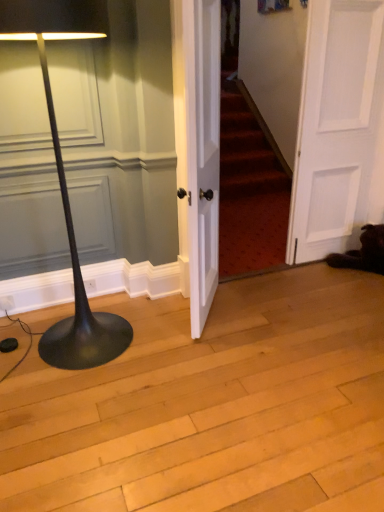
Question: Should I look upward or downward to see white matte door at right, which is counted as the 2th door, starting from the left?

Choices:
 (A) up
 (B) down

Answer: (A)

Question: Should I look upward or downward to see white wood door at center, the first door positioned from the left?

Choices:
 (A) down
 (B) up

Answer: (B)

Question: Is white matte door at right, which is counted as the 2th door, starting from the left, facing towards white wood door at center, the second door when ordered from right to left?

Choices:
 (A) yes
 (B) no

Answer: (B)

Question: Is white matte door at right, which is counted as the 2th door, starting from the left, bigger than white wood door at center, the second door when ordered from right to left?

Choices:
 (A) no
 (B) yes

Answer: (A)

Question: Considering the relative sizes of white matte door at right, acting as the 1th door starting from the right, and white wood door at center, the first door positioned from the left, in the image provided, is white matte door at right, acting as the 1th door starting from the right, thinner than white wood door at center, the first door positioned from the left,?

Choices:
 (A) yes
 (B) no

Answer: (A)

Question: Considering the relative sizes of white matte door at right, acting as the 1th door starting from the right, and white wood door at center, the first door positioned from the left, in the image provided, is white matte door at right, acting as the 1th door starting from the right, smaller than white wood door at center, the first door positioned from the left,?

Choices:
 (A) yes
 (B) no

Answer: (A)

Question: Are white matte door at right, which is counted as the 2th door, starting from the left, and white wood door at center, the second door when ordered from right to left, located far from each other?

Choices:
 (A) yes
 (B) no

Answer: (B)

Question: Does white matte door at right, acting as the 1th door starting from the right, appear on the left side of white wood door at center, the first door positioned from the left?

Choices:
 (A) yes
 (B) no

Answer: (B)

Question: Does black matte floor lamp at left have a lesser height compared to white matte door at right, acting as the 1th door starting from the right?

Choices:
 (A) no
 (B) yes

Answer: (B)

Question: From the image's perspective, would you say black matte floor lamp at left is positioned over white matte door at right, acting as the 1th door starting from the right?

Choices:
 (A) yes
 (B) no

Answer: (B)

Question: Is black matte floor lamp at left oriented towards white matte door at right, acting as the 1th door starting from the right?

Choices:
 (A) yes
 (B) no

Answer: (B)

Question: Is black matte floor lamp at left positioned before white matte door at right, which is counted as the 2th door, starting from the left?

Choices:
 (A) yes
 (B) no

Answer: (A)

Question: Is white matte door at right, which is counted as the 2th door, starting from the left, at the back of black matte floor lamp at left?

Choices:
 (A) yes
 (B) no

Answer: (B)

Question: Considering the relative sizes of black matte floor lamp at left and white matte door at right, which is counted as the 2th door, starting from the left, in the image provided, is black matte floor lamp at left smaller than white matte door at right, which is counted as the 2th door, starting from the left,?

Choices:
 (A) no
 (B) yes

Answer: (A)

Question: Considering the relative sizes of white wood door at center, the second door when ordered from right to left, and black matte floor lamp at left in the image provided, is white wood door at center, the second door when ordered from right to left, wider than black matte floor lamp at left?

Choices:
 (A) no
 (B) yes

Answer: (A)